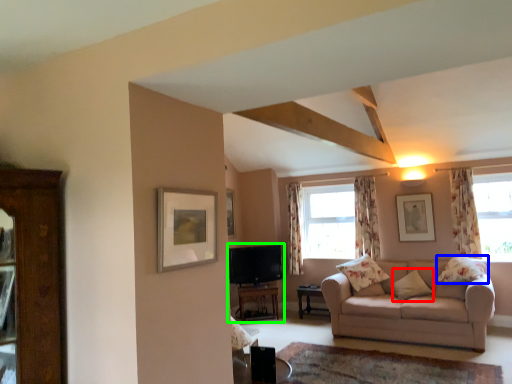
Question: Based on their relative distances, which object is farther from pillow (highlighted by a red box)? Choose from pillow (highlighted by a blue box) and entertainment center (highlighted by a green box).

Choices:
 (A) pillow
 (B) entertainment center

Answer: (B)